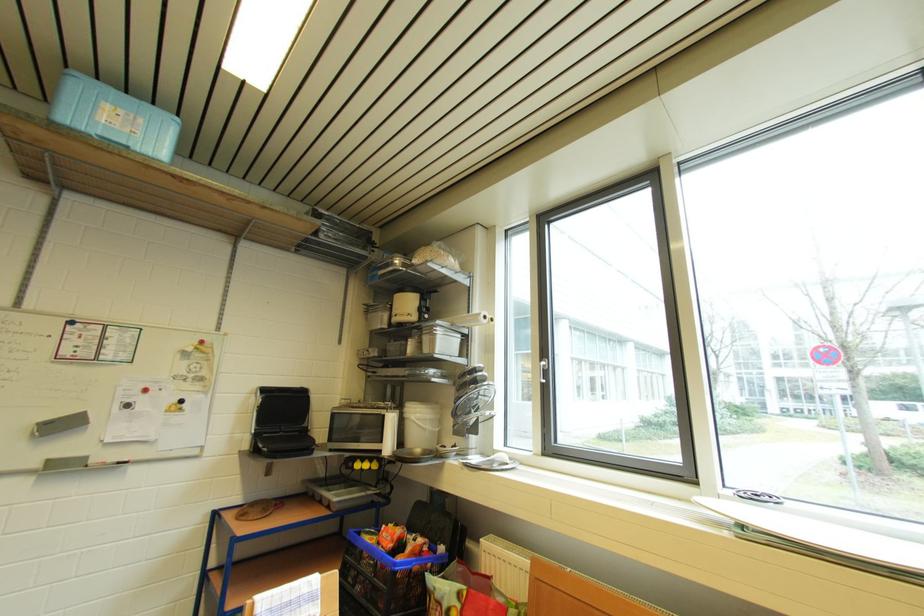
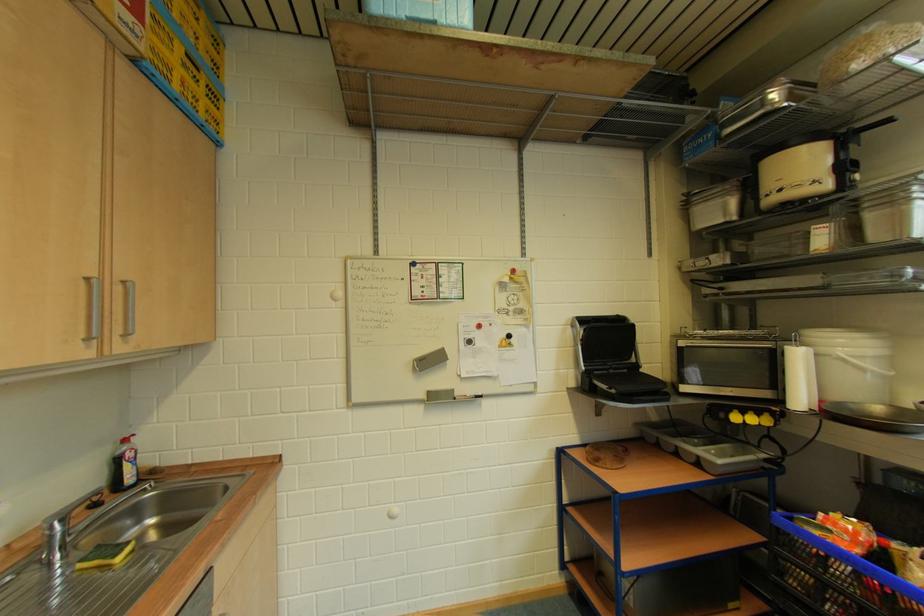
Locate, in the second image, the point that corresponds to the point at 263,398 in the first image.

(579, 329)